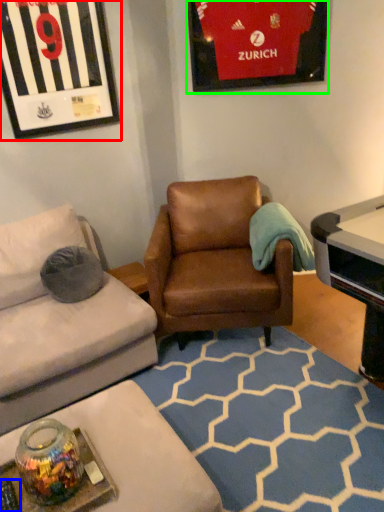
Question: Which object is the farthest from picture frame (highlighted by a red box)? Choose among these: remote control (highlighted by a blue box) or picture frame (highlighted by a green box).

Choices:
 (A) remote control
 (B) picture frame

Answer: (A)